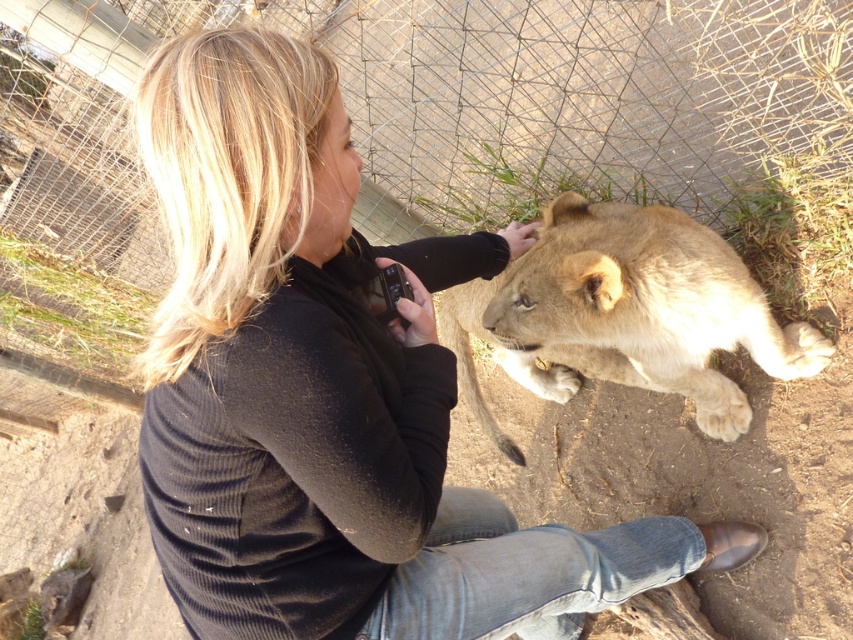
Question: Which point appears farthest from the camera in this image?

Choices:
 (A) (16, 22)
 (B) (175, 452)

Answer: (A)

Question: Where is dark gray sweater at center located in relation to light brown fur at center in the image?

Choices:
 (A) left
 (B) right

Answer: (A)

Question: Considering the real-world distances, which object is closest to the light brown fur at center?

Choices:
 (A) metal mesh fence at upper center
 (B) dark gray sweater at center

Answer: (B)

Question: Which object appears farthest from the camera in this image?

Choices:
 (A) light brown fur at center
 (B) metal mesh fence at upper center
 (C) dark gray sweater at center

Answer: (B)

Question: Is dark gray sweater at center below light brown fur at center?

Choices:
 (A) yes
 (B) no

Answer: (A)

Question: Can you confirm if dark gray sweater at center is bigger than metal mesh fence at upper center?

Choices:
 (A) no
 (B) yes

Answer: (A)